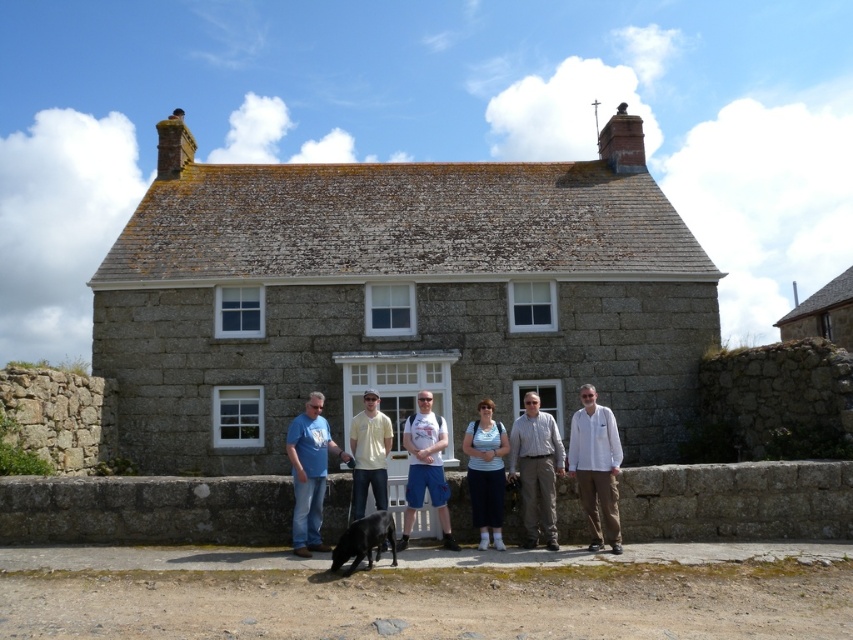
Can you confirm if gray cotton shirt at center is positioned above white cotton t-shirt at center?

Correct, gray cotton shirt at center is located above white cotton t-shirt at center.

Between gray cotton shirt at center and white cotton t-shirt at center, which one appears on the left side from the viewer's perspective?

From the viewer's perspective, white cotton t-shirt at center appears more on the left side.

Is point (544, 440) positioned after point (445, 531)?

That is True.

You are a GUI agent. You are given a task and a screenshot of the screen. Output one action in this format:
    pyautogui.click(x=<x>, y=<y>)
    Task: Click on the gray cotton shirt at center
    This screenshot has height=640, width=853.
    Given the screenshot: What is the action you would take?
    pyautogui.click(x=537, y=468)

Can you confirm if matte blue t-shirt at center is positioned to the left of matte blue shirt at center?

Indeed, matte blue t-shirt at center is positioned on the left side of matte blue shirt at center.

Locate an element on the screen. matte blue t-shirt at center is located at coordinates (309, 474).

This screenshot has height=640, width=853. Identify the location of matte blue t-shirt at center. pos(309,474).

Where is `white cotton shirt at center`? white cotton shirt at center is located at coordinates (596, 467).